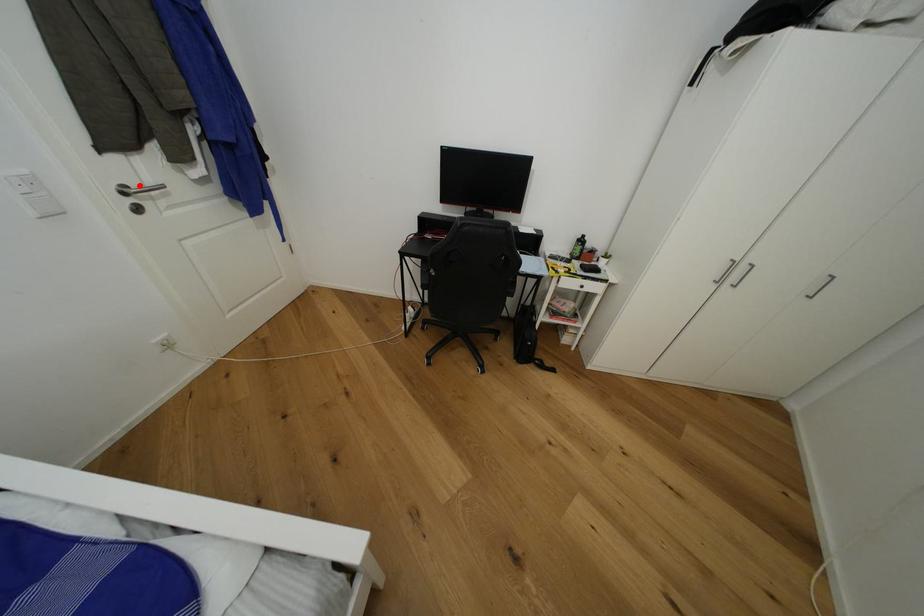
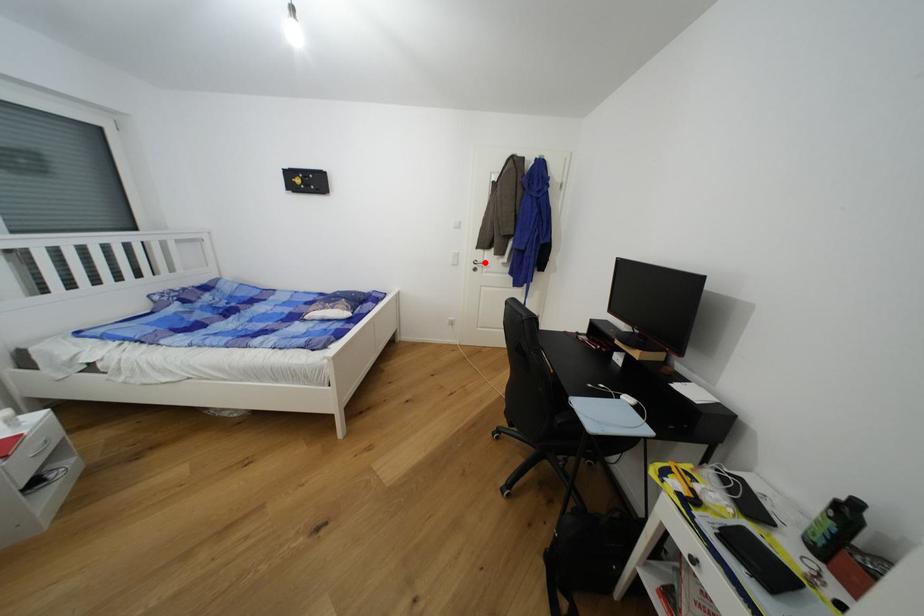
I am providing you with two images of the same scene from different viewpoints. A red point is marked on the first image and another point is marked on the second image. Do the highlighted points in image1 and image2 indicate the same real-world spot?

Yes